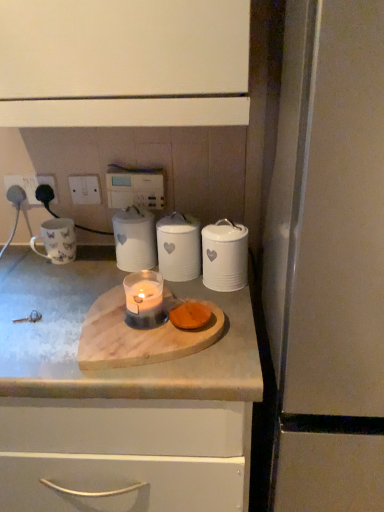
Where is `blank space situated above wooden cutting board at center (from a real-world perspective)`? The image size is (384, 512). blank space situated above wooden cutting board at center (from a real-world perspective) is located at coordinates (132, 326).